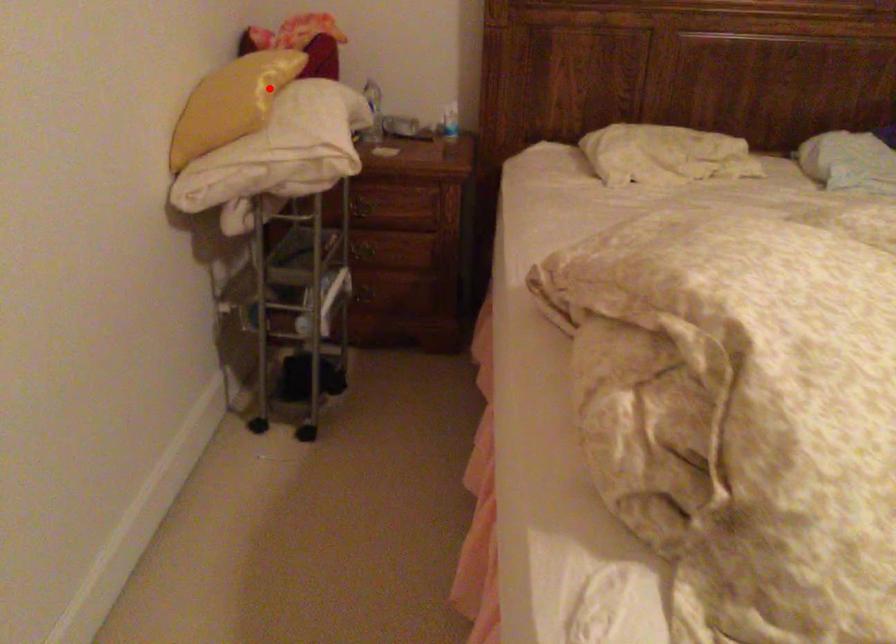
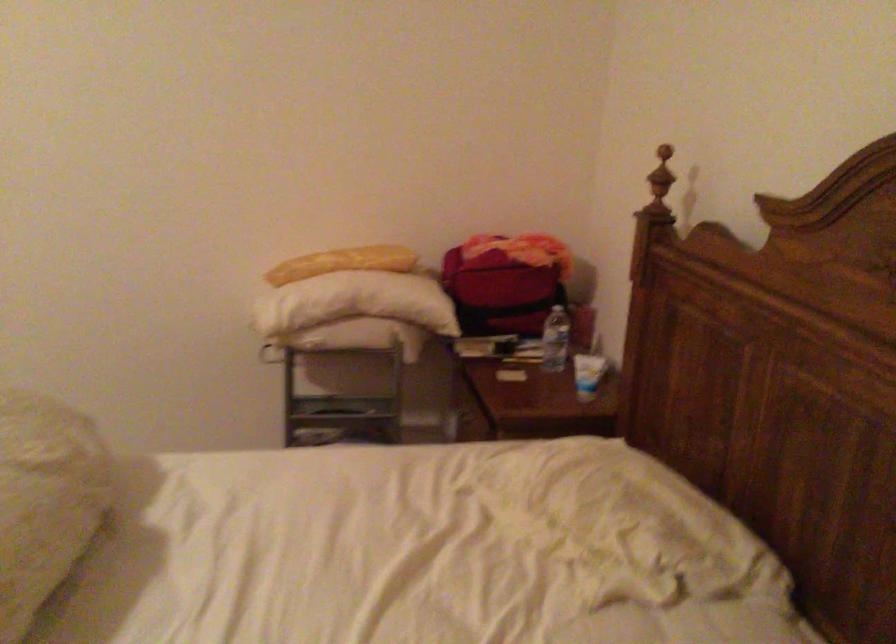
Question: I am providing you with two images of the same scene from different viewpoints. Image1 has a red point marked. In image2, the corresponding 3D location appears at what relative position? Reply with the corresponding letter.

Choices:
 (A) Closer
 (B) Farther

Answer: (B)